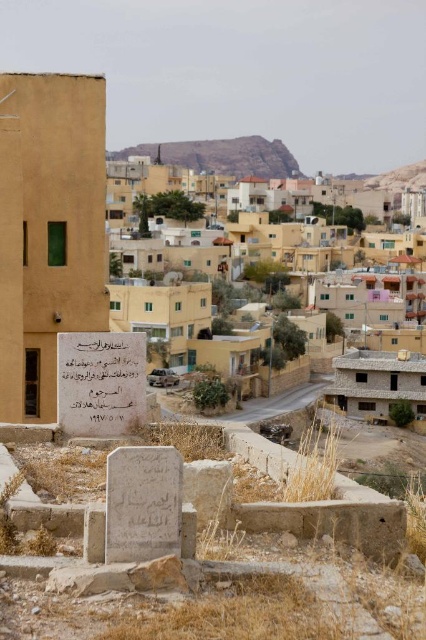
Question: Among these points, which one is nearest to the camera?

Choices:
 (A) (287, 266)
 (B) (63, 364)
 (C) (120, 156)

Answer: (B)

Question: Estimate the real-world distances between objects in this image. Which object is farther from the stone inscription at center?

Choices:
 (A) beige stone buildings at center
 (B) brown rocky hillside at upper center

Answer: (B)

Question: Based on their relative distances, which object is farther from the beige stone buildings at center?

Choices:
 (A) stone inscription at center
 (B) brown rocky hillside at upper center

Answer: (A)

Question: Does beige stone buildings at center appear over stone inscription at center?

Choices:
 (A) yes
 (B) no

Answer: (A)

Question: Where is beige stone buildings at center located in relation to stone inscription at center in the image?

Choices:
 (A) right
 (B) left

Answer: (A)

Question: Does stone inscription at center have a smaller size compared to brown rocky hillside at upper center?

Choices:
 (A) no
 (B) yes

Answer: (B)